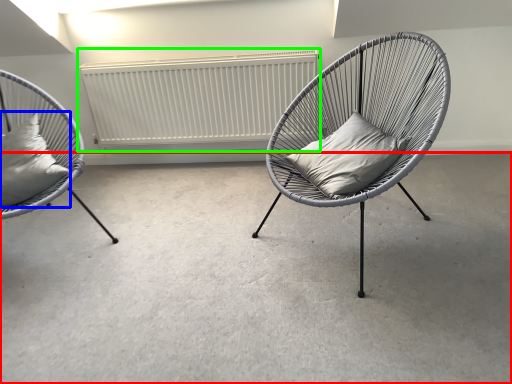
Question: Which object is positioned farthest from concrete (highlighted by a red box)? Select from pillow (highlighted by a blue box) and radiator (highlighted by a green box).

Choices:
 (A) pillow
 (B) radiator

Answer: (B)